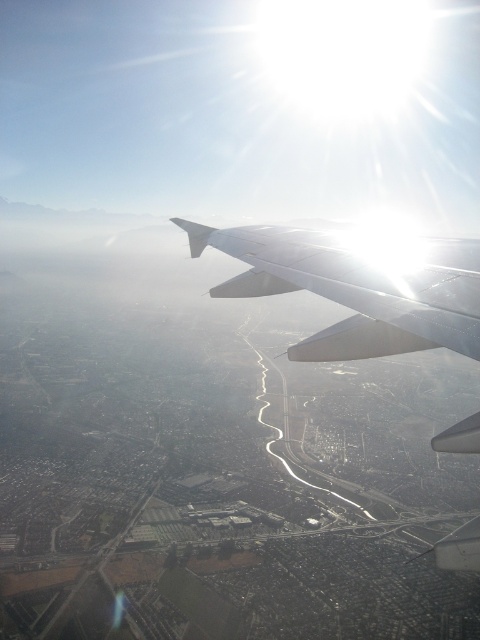
Between white matte wing at upper center and white glossy wing at upper center, which one appears on the left side from the viewer's perspective?

From the viewer's perspective, white glossy wing at upper center appears more on the left side.

Does white matte wing at upper center have a greater width compared to white glossy wing at upper center?

Yes, white matte wing at upper center is wider than white glossy wing at upper center.

Image resolution: width=480 pixels, height=640 pixels. In order to click on white matte wing at upper center in this screenshot , I will do `click(348, 292)`.

Where is `white matte wing at upper center`? The height and width of the screenshot is (640, 480). white matte wing at upper center is located at coordinates (348, 292).